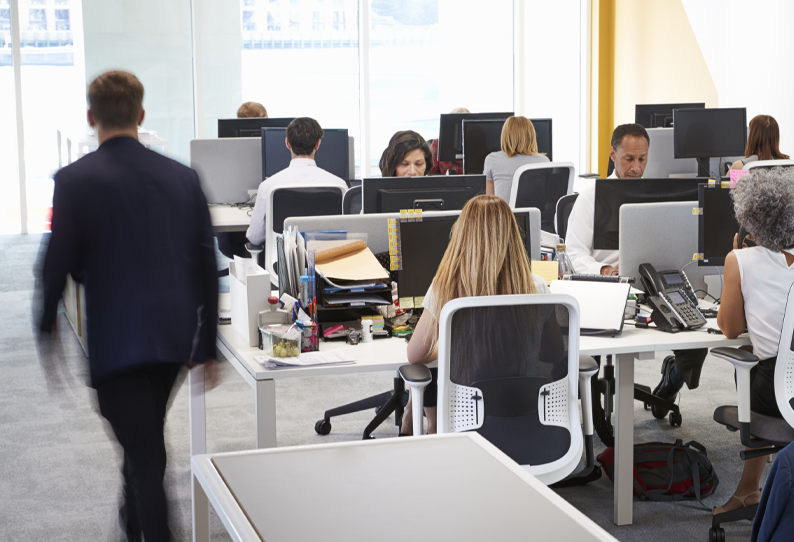
Identify the location of computer chairs. (781, 379), (750, 419), (530, 434), (642, 391), (387, 396), (224, 244), (311, 203), (530, 183), (750, 165), (561, 207).